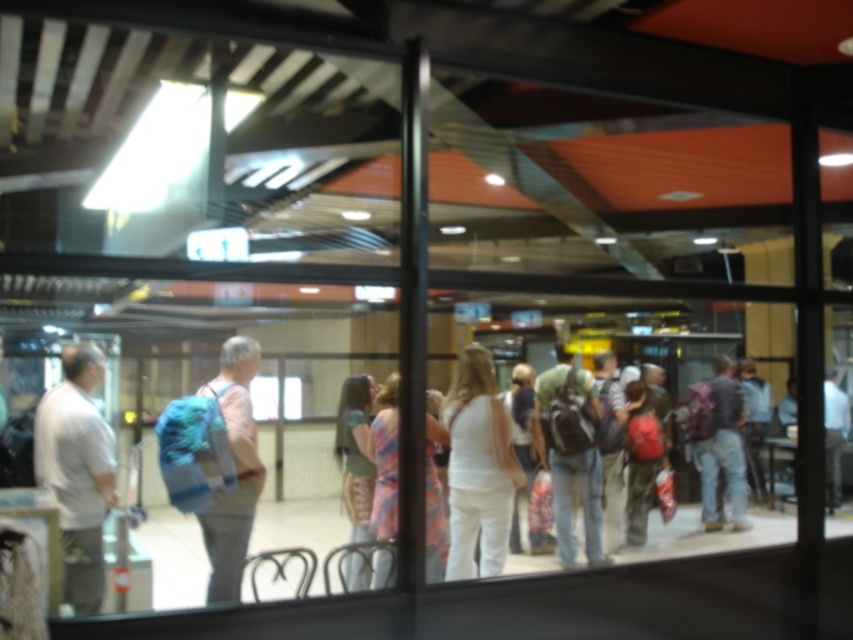
You are a photographer trying to capture a candid shot of both the matte purple backpack at center and the plaid fabric dress at center through the glass window. Since the window is slightly blurred, you need to adjust your camera settings to ensure both subjects are in focus. Considering their sizes, which object requires more careful adjustment to avoid blurriness?

The matte purple backpack at center is wider than the plaid fabric dress at center. Since the backpack is wider, it may require more careful adjustment to ensure the entire width is in focus, especially in a blurred environment. However, both objects need attention due to the window blur.

You are a traveler who wants to place both your matte gray backpack at center and your matte purple backpack at center on a bench that can only hold one backpack at a time. Based on the image, which backpack should you place first to ensure both can fit?

The matte gray backpack at center might be wider than matte purple backpack at center, so you should place the matte gray backpack at center first to ensure both can fit on the bench.